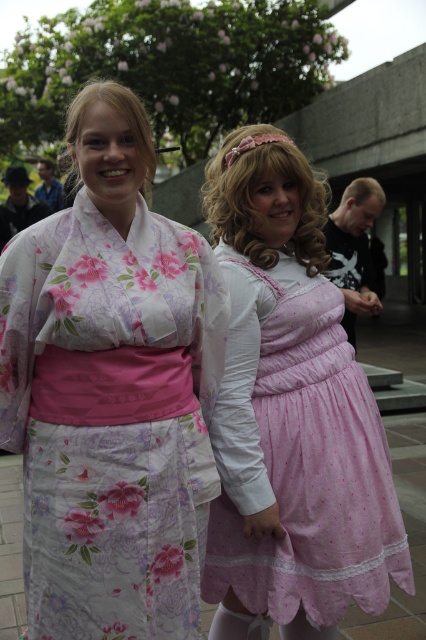
Who is higher up, pink satin dress at center or matte black shirt at right?

matte black shirt at right is above.

Does pink satin dress at center appear under matte black shirt at right?

Yes.

Between point (279, 348) and point (339, 220), which one is positioned behind?

Point (339, 220)

Where is `pink satin dress at center`? This screenshot has height=640, width=426. pink satin dress at center is located at coordinates (299, 456).

How much distance is there between floral silk kimono at center and pink satin dress at center?

14.90 inches

Does floral silk kimono at center appear over pink satin dress at center?

Yes, floral silk kimono at center is above pink satin dress at center.

Between point (69, 400) and point (288, 461), which one is positioned in front?

Positioned in front is point (69, 400).

The width and height of the screenshot is (426, 640). What are the coordinates of `floral silk kimono at center` in the screenshot? It's located at (112, 392).

Can you confirm if floral silk kimono at center is shorter than matte black shirt at right?

No, floral silk kimono at center is not shorter than matte black shirt at right.

How distant is floral silk kimono at center from matte black shirt at right?

The distance of floral silk kimono at center from matte black shirt at right is 2.79 meters.

Between point (114, 428) and point (360, 186), which one is positioned in front?

Point (114, 428)

Find the location of a particular element. floral silk kimono at center is located at coordinates (112, 392).